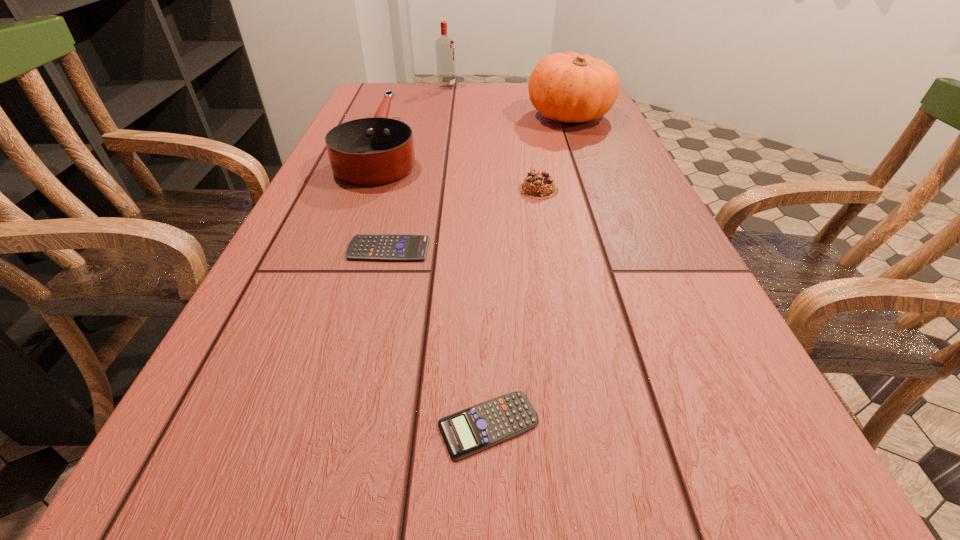
This screenshot has height=540, width=960. Find the location of `free space that satisfies the following two spatial constraints: 1. on the handle side of the pan; 2. on the left side of the pumpkin`. free space that satisfies the following two spatial constraints: 1. on the handle side of the pan; 2. on the left side of the pumpkin is located at coordinates (394, 116).

The image size is (960, 540). Identify the location of free spot that satisfies the following two spatial constraints: 1. on the front label of the tallest object; 2. on the left side of the chocolate cake. (430, 189).

Locate an element on the screen. vacant region that satisfies the following two spatial constraints: 1. on the handle side of the third tallest object; 2. on the right side of the pumpkin is located at coordinates (394, 116).